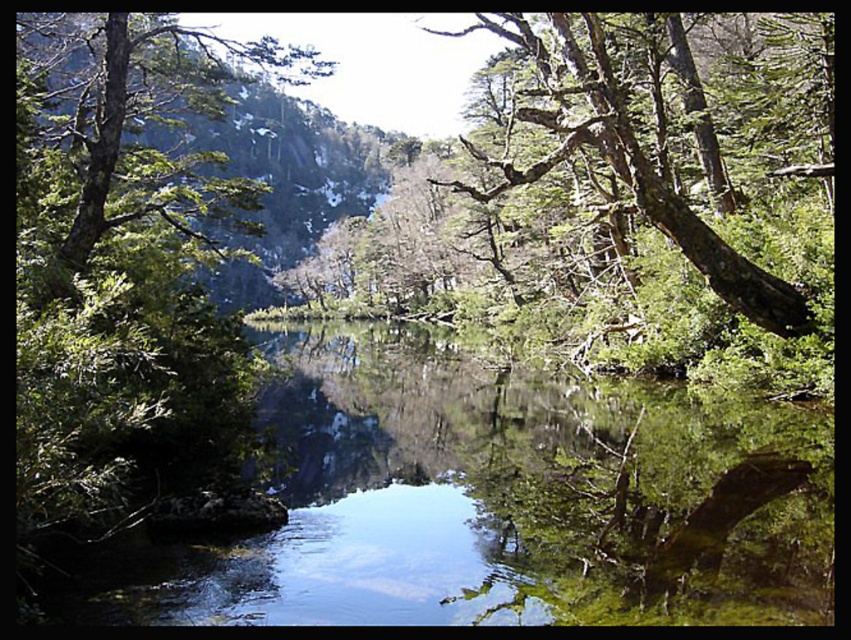
From the picture: You are an environmental scientist assessing the biodiversity of this area. You notice the green leafy tree at upper left and the green bark tree at upper right. Which tree has a wider canopy, and how might this affect their roles in the ecosystem?

The green leafy tree at upper left has a wider canopy than the green bark tree at upper right. A wider canopy can provide more shade, support a greater number of epiphytes, and contribute to higher biodiversity by offering varied habitats for insects and birds.

You are standing in the landscape and want to walk towards both the green leafy tree at upper left and the green bark tree at upper right. Which tree will you reach first?

You will reach the green leafy tree at upper left first because it is closer to you than the green bark tree at upper right.